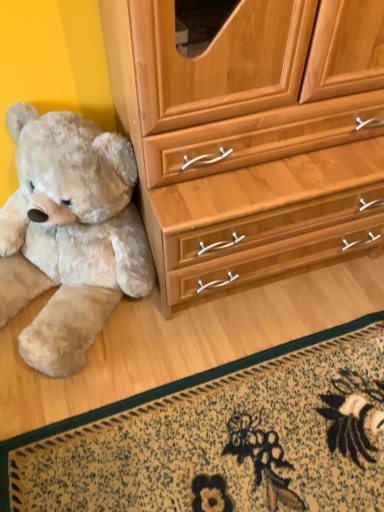
Question: Based on their sizes in the image, would you say fluffy beige teddy bear at left is bigger or smaller than floral carpet at lower center?

Choices:
 (A) big
 (B) small

Answer: (A)

Question: Would you say fluffy beige teddy bear at left is inside or outside floral carpet at lower center?

Choices:
 (A) inside
 (B) outside

Answer: (B)

Question: In the image, is fluffy beige teddy bear at left positioned in front of or behind floral carpet at lower center?

Choices:
 (A) front
 (B) behind

Answer: (A)

Question: Choose the correct answer: Is floral carpet at lower center inside fluffy beige teddy bear at left or outside it?

Choices:
 (A) outside
 (B) inside

Answer: (A)

Question: In the image, is floral carpet at lower center on the left side or the right side of fluffy beige teddy bear at left?

Choices:
 (A) left
 (B) right

Answer: (B)

Question: From the image's perspective, relative to fluffy beige teddy bear at left, is floral carpet at lower center above or below?

Choices:
 (A) below
 (B) above

Answer: (A)

Question: Does point (173, 438) appear closer or farther from the camera than point (140, 253)?

Choices:
 (A) closer
 (B) farther

Answer: (A)